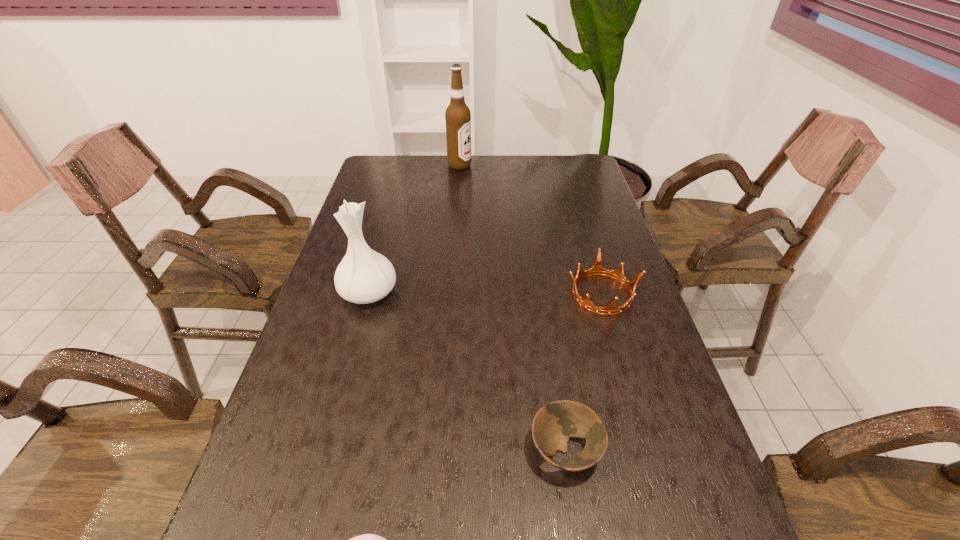
Locate an element on the screen. The height and width of the screenshot is (540, 960). object at the left edge is located at coordinates (364, 276).

This screenshot has height=540, width=960. Find the location of `object positioned at the right edge`. object positioned at the right edge is located at coordinates (597, 269).

Identify the location of blank area at the far edge. (453, 182).

Locate an element on the screen. This screenshot has width=960, height=540. free space at the left edge of the desktop is located at coordinates (316, 488).

At what (x,y) coordinates should I click in order to perform the action: click on vacant region at the right edge of the desktop. Please return your answer as a coordinate pair (x, y). Looking at the image, I should click on (641, 491).

The width and height of the screenshot is (960, 540). What are the coordinates of `blank space at the far left corner` in the screenshot? It's located at (363, 183).

Identify the location of empty space between the vase and the fourth farthest object. (467, 372).

The width and height of the screenshot is (960, 540). I want to click on empty space between the farthest object and the bowl, so click(513, 308).

Find the location of a particular element. Image resolution: width=960 pixels, height=540 pixels. free spot between the crown and the fourth farthest object is located at coordinates (584, 372).

Identify the location of vacant space that's between the alcohol and the second nearest object. click(513, 308).